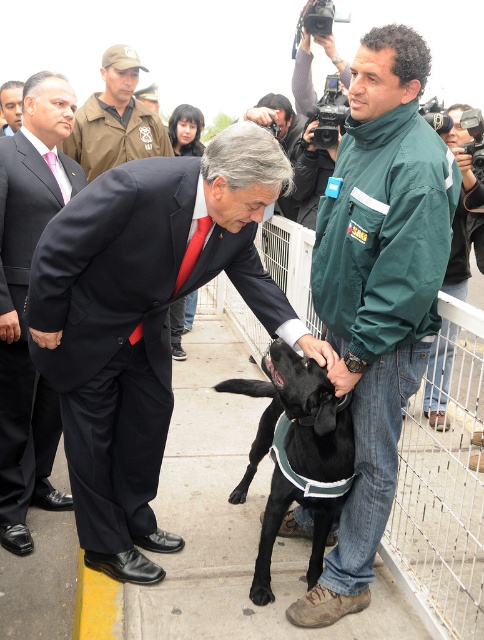
Looking at this image, can you confirm if matte black suit at center is positioned to the left of matte black suit at left?

In fact, matte black suit at center is to the right of matte black suit at left.

Is matte black suit at center shorter than matte black suit at left?

Yes, matte black suit at center is shorter than matte black suit at left.

Is point (43, 266) farther from viewer compared to point (48, 435)?

No, it is in front of (48, 435).

Locate an element on the screen. matte black suit at center is located at coordinates (145, 321).

Is point (76, 122) positioned in front of point (468, 106)?

Yes.

Who is shorter, camouflage uniform at upper left or green fabric jacket at upper right?

Standing shorter between the two is camouflage uniform at upper left.

Is point (132, 120) more distant than point (455, 152)?

Yes, point (132, 120) is behind point (455, 152).

You are a GUI agent. You are given a task and a screenshot of the screen. Output one action in this format:
    pyautogui.click(x=<x>, y=<y>)
    Task: Click on the camouflage uniform at upper left
    This screenshot has height=640, width=484.
    Given the screenshot: What is the action you would take?
    pyautogui.click(x=116, y=120)

Can you confirm if black matte dog at center is bigger than camouflage uniform at upper left?

Correct, black matte dog at center is larger in size than camouflage uniform at upper left.

Is point (252, 472) in front of point (129, 51)?

That is True.

The width and height of the screenshot is (484, 640). What are the coordinates of `black matte dog at center` in the screenshot? It's located at (297, 452).